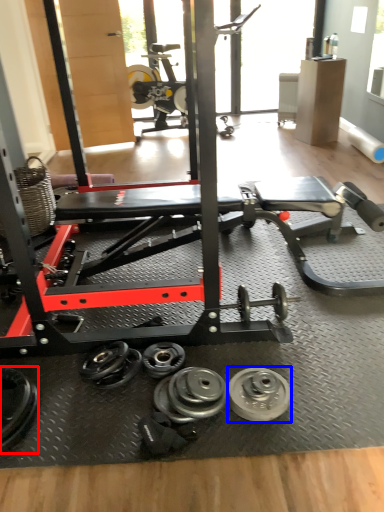
Question: Which point is closer to the camera, dumbbell (highlighted by a red box) or wheel (highlighted by a blue box)?

Choices:
 (A) dumbbell
 (B) wheel

Answer: (A)